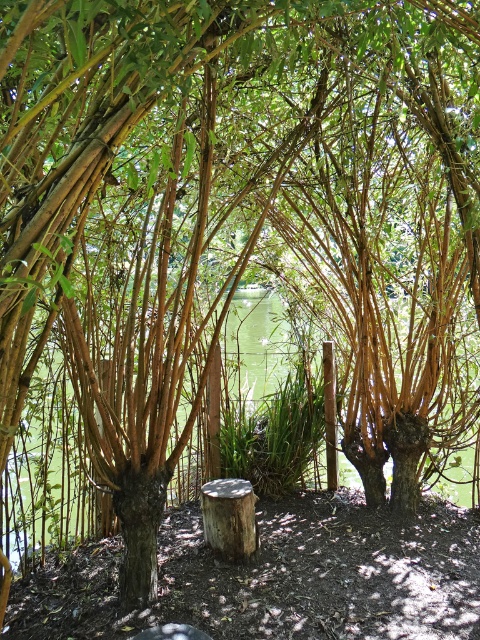
You are standing in the outdoor scene under the bamboo archway. You see the green liquid water at center and the light brown wood stump at center. Which object is positioned to the left of the other?

The green liquid water at center is to the left of light brown wood stump at center.

You are planning to place a small potted plant between the green liquid water at center and the light brown wood stump at center. Since both are at the center, which one is wider so you can position the plant appropriately?

The green liquid water at center is wider than the light brown wood stump at center, so you should position the plant next to the wider area of the green liquid water at center.